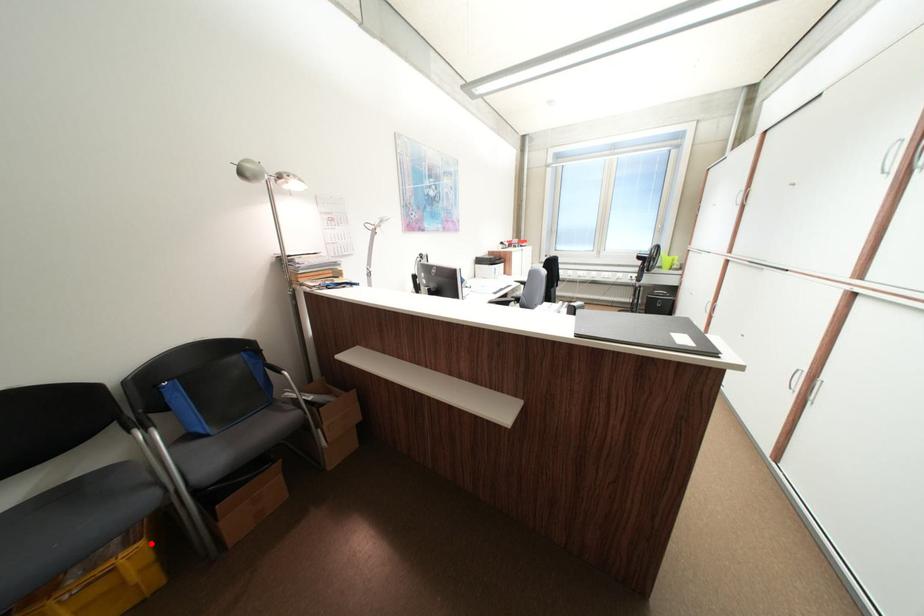
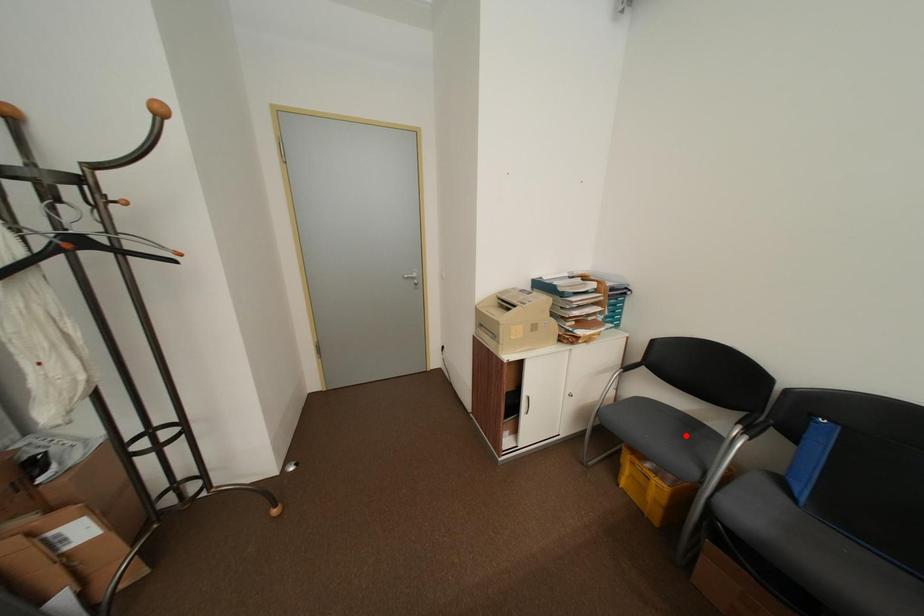
I am providing you with two images of the same scene from different viewpoints. A red point is marked on the first image and another point is marked on the second image. Does the point marked in image1 correspond to the same location as the one in image2?

No